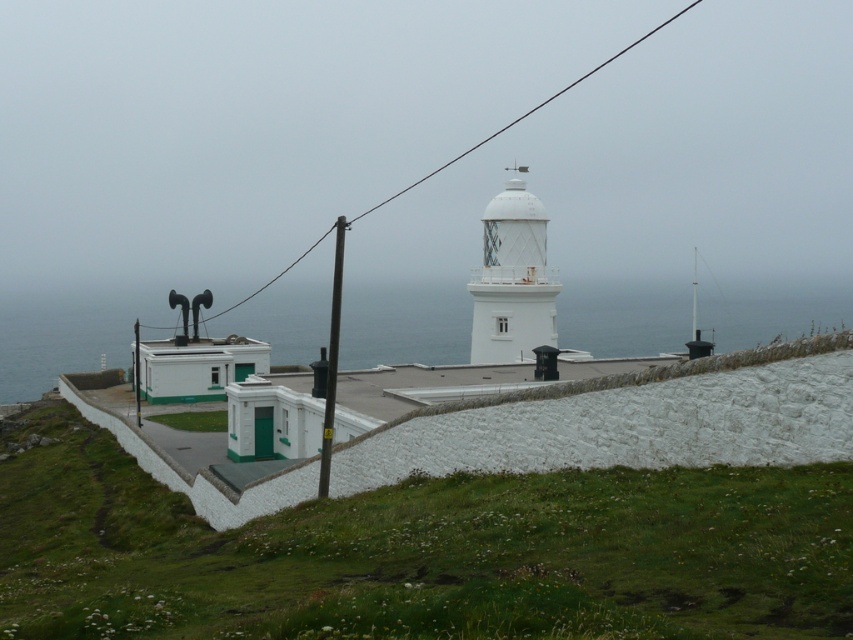
Question: Which point is farther to the camera?

Choices:
 (A) (138, 404)
 (B) (616, 58)
 (C) (335, 348)

Answer: (B)

Question: From the image, what is the correct spatial relationship of white textured lighthouse at center in relation to smooth metallic pole at center?

Choices:
 (A) right
 (B) left

Answer: (A)

Question: Which point is closer to the camera taking this photo?

Choices:
 (A) (479, 308)
 (B) (136, 378)

Answer: (A)

Question: Which of the following is the closest to the observer?

Choices:
 (A) (659, 28)
 (B) (136, 376)
 (C) (474, 273)

Answer: (C)

Question: In this image, where is transparent water at lower left located relative to black wire at upper center?

Choices:
 (A) left
 (B) right

Answer: (A)

Question: Does transparent water at lower left lie behind white textured lighthouse at center?

Choices:
 (A) no
 (B) yes

Answer: (B)